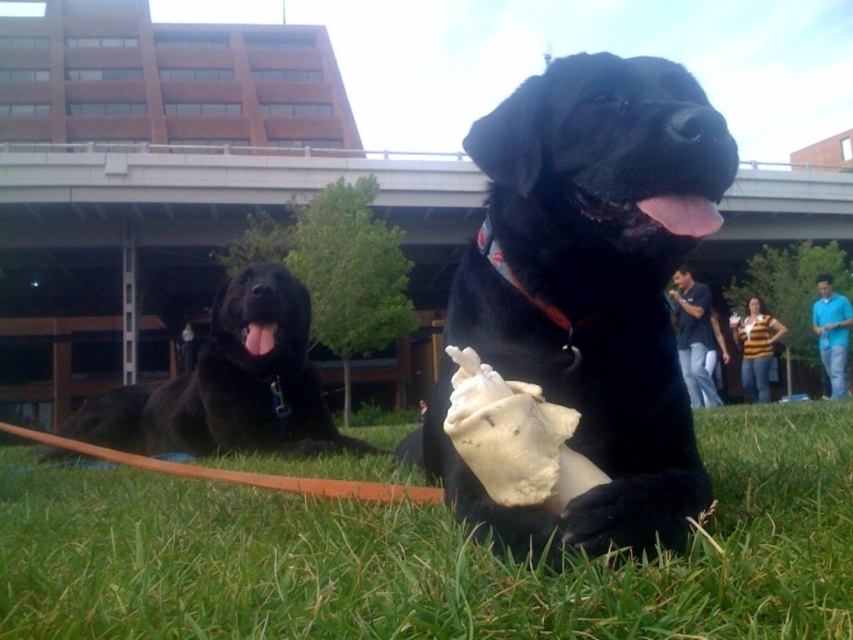
You are a photographer trying to focus on the two points in the image. Which point is closer to your camera, point (361, 547) or point (152, 428)?

Point (361, 547) is closer to the camera than point (152, 428).